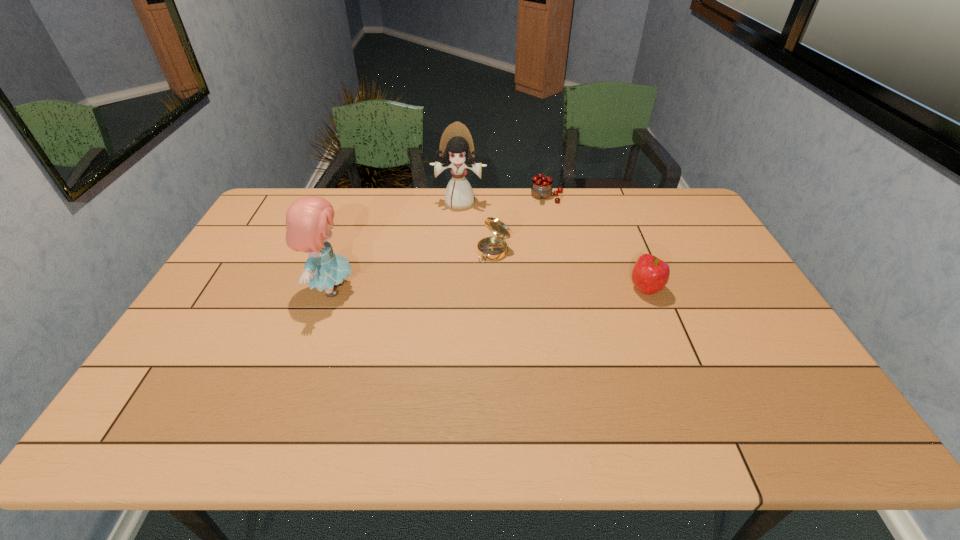
The height and width of the screenshot is (540, 960). I want to click on vacant space on the desktop that is between the leftmost object and the rightmost object and is positioned with the dial facing the compass, so (x=453, y=289).

What are the coordinates of `free space on the desktop that is between the nearer doll and the apple and is positioned at the front face of the right doll` in the screenshot? It's located at (445, 289).

Where is `free space on the desktop that is between the left doll and the rightmost object and is positioned on the handle side of the pot filled with cherries`? The height and width of the screenshot is (540, 960). free space on the desktop that is between the left doll and the rightmost object and is positioned on the handle side of the pot filled with cherries is located at coordinates (529, 289).